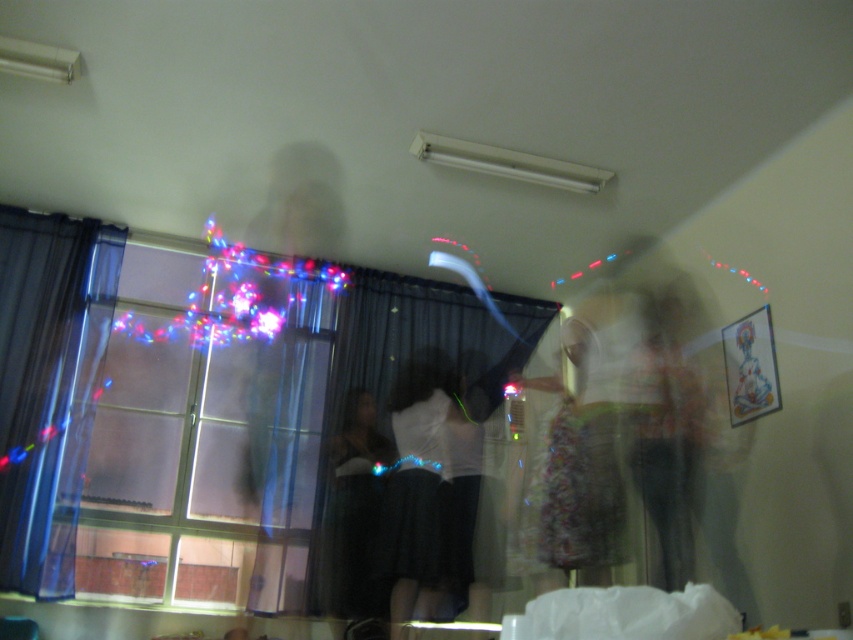
Is transparent fabric curtain at left below dark gray dress at center?

No, transparent fabric curtain at left is not below dark gray dress at center.

Looking at this image, between transparent fabric curtain at left and dark gray dress at center, which one is positioned lower?

dark gray dress at center

Where is `transparent fabric curtain at left`? The image size is (853, 640). transparent fabric curtain at left is located at coordinates (48, 385).

Which is below, matte white blouse at center or dark gray dress at center?

Positioned lower is dark gray dress at center.

The height and width of the screenshot is (640, 853). What do you see at coordinates (415, 486) in the screenshot?
I see `matte white blouse at center` at bounding box center [415, 486].

The image size is (853, 640). I want to click on matte white blouse at center, so click(x=415, y=486).

Based on the photo, between translucent glass window at left and dark gray dress at center, which one appears on the left side from the viewer's perspective?

Positioned to the left is translucent glass window at left.

Does point (230, 605) come behind point (355, 461)?

No, it is in front of (355, 461).

Is point (224, 525) positioned in front of point (343, 512)?

Yes, it is in front of point (343, 512).

Where is `translucent glass window at left`? The image size is (853, 640). translucent glass window at left is located at coordinates (206, 428).